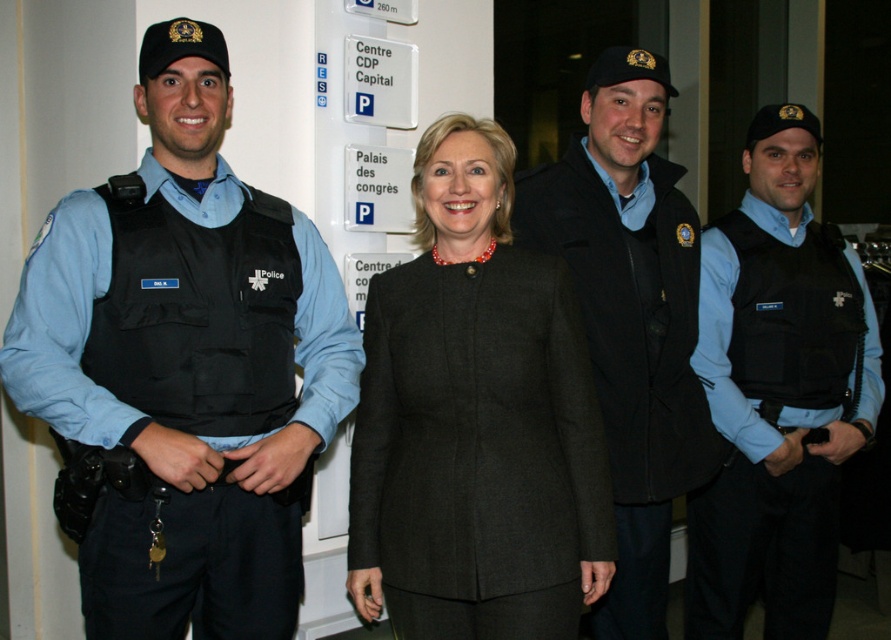
You are standing in the room and want to take a photo of both the woman in the dark suit and the police officer to your left. The woman is at point (375, 328) and the police officer is at point (862, 316). Since you want both to be in focus, which point should you focus on?

You should focus on point (375, 328) because it is closer to the camera than point (862, 316). By focusing on the closer point, both subjects will be in focus as the depth of field will cover the distance between them.

In the scene shown: You are a guest at the event and need to locate the security officer with the longer black matte vest. Which one should you approach between the black matte vest at left and the black matte vest at center?

The black matte vest at center is longer than the black matte vest at left, so you should approach the security officer with the black matte vest at center.

You are standing in the scene and want to determine which of the two points, point (820, 230) or point (513, 236), is closer to you. Based on the spatial arrangement, which point is nearer?

Point (820, 230) is further to the viewer than point (513, 236), so the closer point to you is point (513, 236).